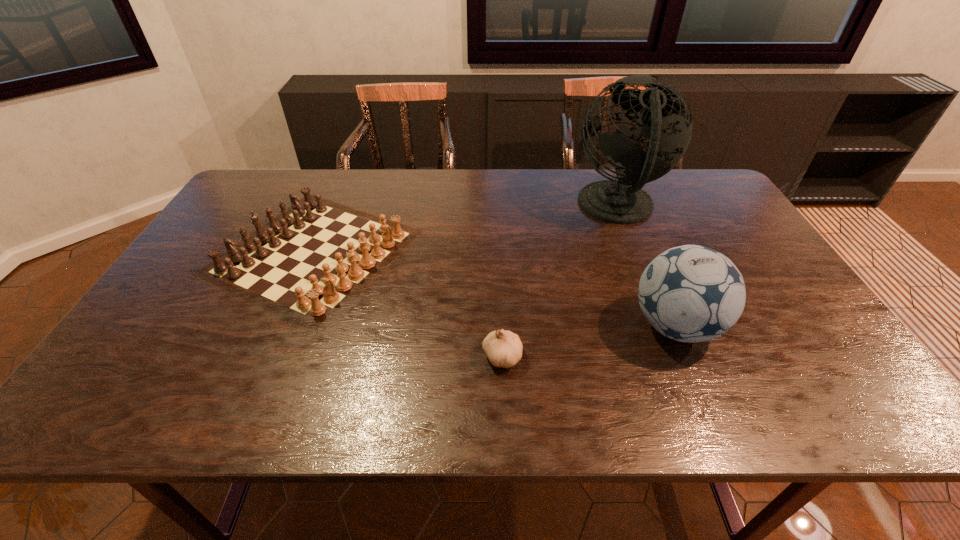
Identify the location of globe. The image size is (960, 540). (658, 112).

Where is `the third shortest object`? the third shortest object is located at coordinates (691, 293).

At what (x,y) coordinates should I click in order to perform the action: click on the second shortest object. Please return your answer as a coordinate pair (x, y). The image size is (960, 540). Looking at the image, I should click on (309, 261).

You are a GUI agent. You are given a task and a screenshot of the screen. Output one action in this format:
    pyautogui.click(x=<x>, y=<y>)
    Task: Click on the chessboard
    This screenshot has height=540, width=960.
    Given the screenshot: What is the action you would take?
    pyautogui.click(x=309, y=261)

At what (x,y) coordinates should I click in order to perform the action: click on garlic. Please return your answer as a coordinate pair (x, y). The width and height of the screenshot is (960, 540). Looking at the image, I should click on (503, 348).

Find the location of `the shortest object`. the shortest object is located at coordinates (503, 348).

The height and width of the screenshot is (540, 960). Find the location of `vacant space positioned on the front-facing side of the tallest object`. vacant space positioned on the front-facing side of the tallest object is located at coordinates (545, 208).

At what (x,y) coordinates should I click in order to perform the action: click on vacant space situated 0.280m on the front-facing side of the tallest object. Please return your answer as a coordinate pair (x, y). The width and height of the screenshot is (960, 540). Looking at the image, I should click on (484, 208).

Where is `blank space located on the front-facing side of the tallest object`? This screenshot has height=540, width=960. blank space located on the front-facing side of the tallest object is located at coordinates (487, 208).

Where is `free location located on the side with brand of the soccer ball`? The height and width of the screenshot is (540, 960). free location located on the side with brand of the soccer ball is located at coordinates (496, 326).